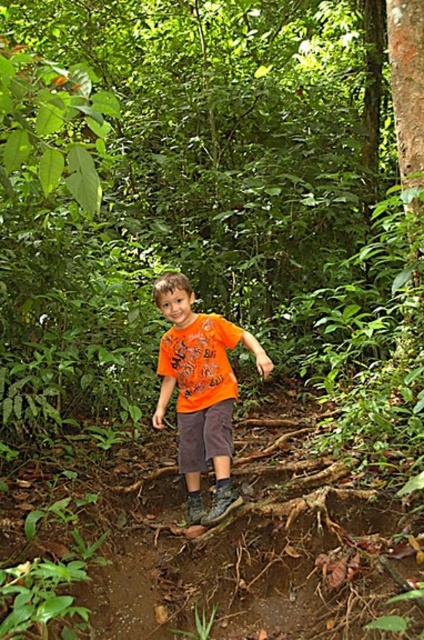
Is point (183, 444) positioned behind point (209, 408)?

Yes, it is behind point (209, 408).

Does point (209, 422) come in front of point (201, 416)?

Yes, it is in front of point (201, 416).

Does point (209, 419) come closer to viewer compared to point (222, 403)?

Yes, point (209, 419) is in front of point (222, 403).

Where is `orange cotton shirt at center`? The height and width of the screenshot is (640, 424). orange cotton shirt at center is located at coordinates (200, 388).